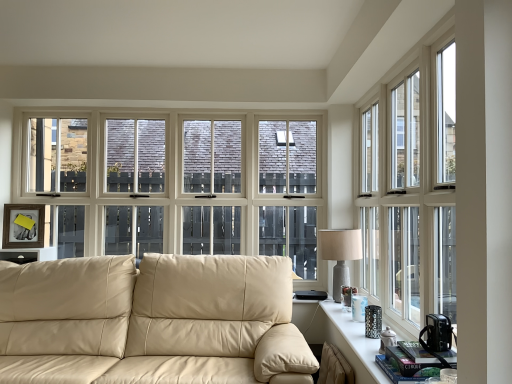
Question: In the image, is beige leather couch at center on the left side or the right side of matte black table at right?

Choices:
 (A) right
 (B) left

Answer: (B)

Question: From the image's perspective, is beige leather couch at center located above or below matte black table at right?

Choices:
 (A) above
 (B) below

Answer: (B)

Question: Based on their relative distances, which object is farther from the matte black picture frame at left?

Choices:
 (A) matte black table at right
 (B) gray concrete table lamp at right
 (C) clear glass window at right
 (D) beige leather couch at center
 (E) matte black side table at left

Answer: (C)

Question: Which object is positioned closest to the matte black picture frame at left?

Choices:
 (A) gray concrete table lamp at right
 (B) matte black table at right
 (C) clear glass window at right
 (D) matte black side table at left
 (E) beige leather couch at center

Answer: (D)